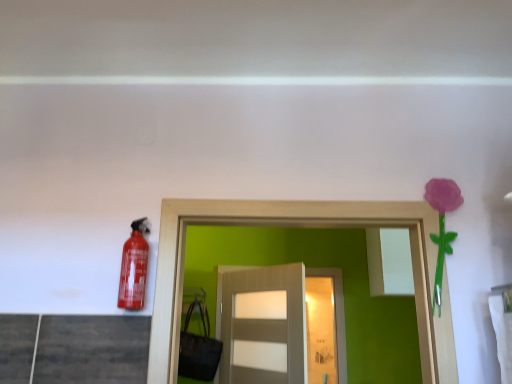
Question: Does purple matte flower at upper right have a lesser height compared to matte gray door at center?

Choices:
 (A) no
 (B) yes

Answer: (B)

Question: From a real-world perspective, is purple matte flower at upper right positioned over matte gray door at center based on gravity?

Choices:
 (A) yes
 (B) no

Answer: (A)

Question: Is the position of purple matte flower at upper right less distant than that of matte gray door at center?

Choices:
 (A) no
 (B) yes

Answer: (B)

Question: Considering the relative sizes of purple matte flower at upper right and matte gray door at center in the image provided, is purple matte flower at upper right thinner than matte gray door at center?

Choices:
 (A) yes
 (B) no

Answer: (A)

Question: Is purple matte flower at upper right bigger than matte gray door at center?

Choices:
 (A) yes
 (B) no

Answer: (B)

Question: Does point (300, 340) appear closer or farther from the camera than point (138, 286)?

Choices:
 (A) farther
 (B) closer

Answer: (A)

Question: Is matte gray door at center situated inside matte red extinguisher at left or outside?

Choices:
 (A) outside
 (B) inside

Answer: (A)

Question: From the image's perspective, is matte gray door at center located above or below matte red extinguisher at left?

Choices:
 (A) above
 (B) below

Answer: (B)

Question: Considering their positions, is matte gray door at center located in front of or behind matte red extinguisher at left?

Choices:
 (A) behind
 (B) front

Answer: (A)

Question: From the image's perspective, relative to purple matte flower at upper right, is matte gray door at center above or below?

Choices:
 (A) below
 (B) above

Answer: (A)

Question: From a real-world perspective, is matte gray door at center above or below purple matte flower at upper right?

Choices:
 (A) above
 (B) below

Answer: (B)

Question: Does point (257, 306) appear closer or farther from the camera than point (448, 249)?

Choices:
 (A) closer
 (B) farther

Answer: (B)

Question: Considering the positions of matte gray door at center and purple matte flower at upper right in the image, is matte gray door at center bigger or smaller than purple matte flower at upper right?

Choices:
 (A) big
 (B) small

Answer: (A)

Question: Based on their sizes in the image, would you say matte red extinguisher at left is bigger or smaller than matte gray door at center?

Choices:
 (A) big
 (B) small

Answer: (B)

Question: From the image's perspective, is matte red extinguisher at left positioned above or below matte gray door at center?

Choices:
 (A) above
 (B) below

Answer: (A)